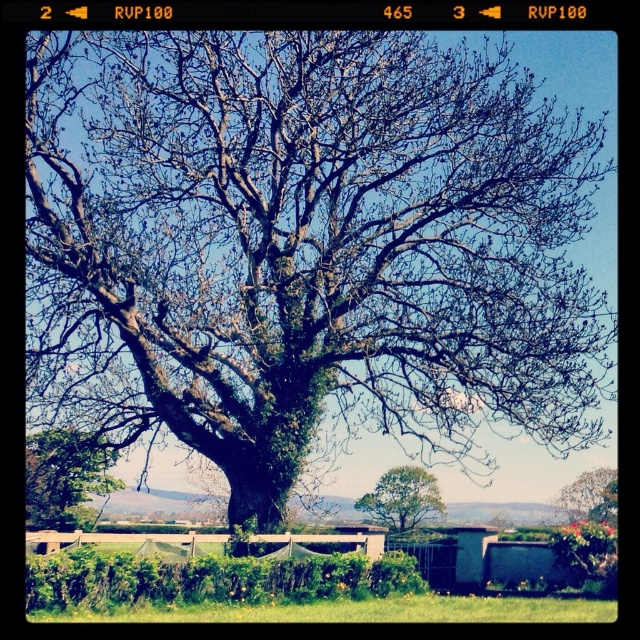
Question: Among these points, which one is nearest to the camera?

Choices:
 (A) (442, 506)
 (B) (589, 506)

Answer: (A)

Question: Considering the real-world distances, which object is farthest from the green mossy tree at center?

Choices:
 (A) green mossy oak at center
 (B) green leafy tree at center
 (C) green grass at lower center

Answer: (A)

Question: Is the position of green grass at lower center less distant than that of green mossy tree at center?

Choices:
 (A) yes
 (B) no

Answer: (A)

Question: Is green grass at lower center closer to camera compared to green leafy tree at lower left?

Choices:
 (A) no
 (B) yes

Answer: (B)

Question: Does green mossy oak at center appear on the right side of green leafy tree at lower left?

Choices:
 (A) yes
 (B) no

Answer: (A)

Question: Which of the following is the farthest from the observer?

Choices:
 (A) green mossy tree at center
 (B) green leafy tree at lower left
 (C) green leafy tree at center

Answer: (C)